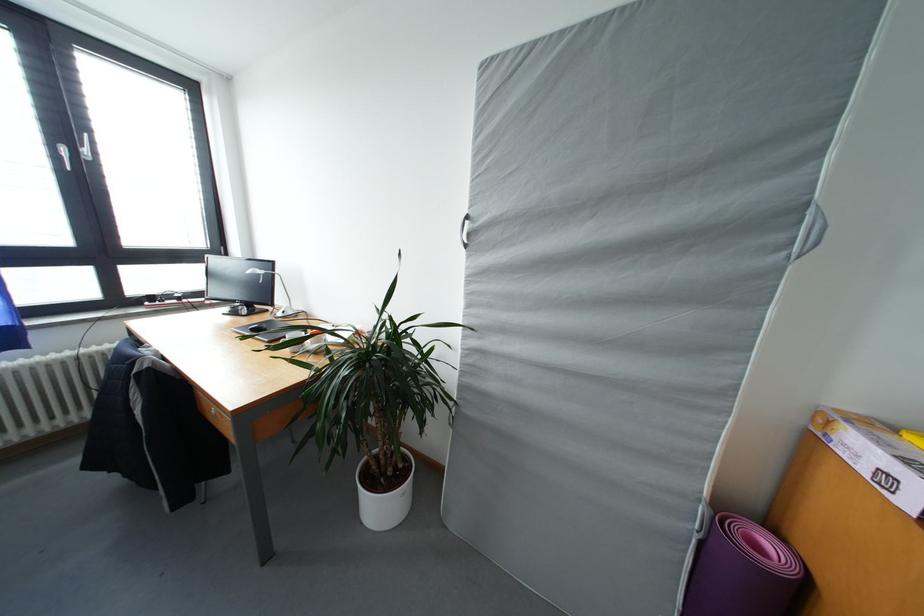
Find where to lift the rolled purple mat. Please return your answer as a coordinate pair (x, y).

(742, 570)